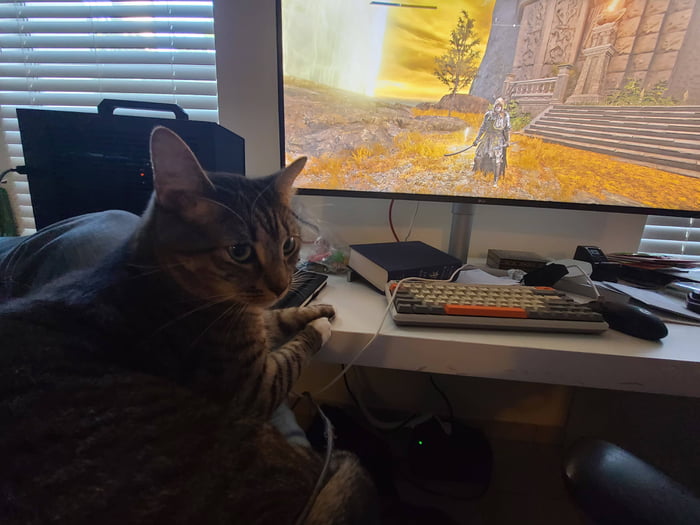
Image resolution: width=700 pixels, height=525 pixels. What are the coordinates of `small green light on floor` in the screenshot? It's located at (419, 440).